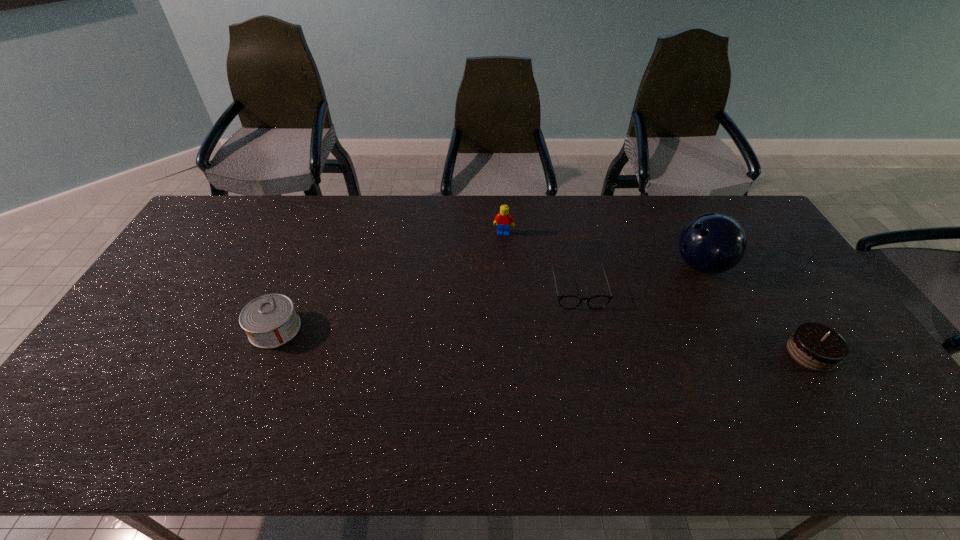
The image size is (960, 540). In order to click on unoccupied position between the fourth tallest object and the fourth object from left to right in this screenshot , I will do `click(489, 298)`.

The image size is (960, 540). In order to click on free space between the second shortest object and the third tallest object in this screenshot , I will do `click(543, 341)`.

You are a GUI agent. You are given a task and a screenshot of the screen. Output one action in this format:
    pyautogui.click(x=<x>, y=<y>)
    Task: Click on the unoccupied position between the second shortest object and the tallest object
    The image size is (960, 540).
    Given the screenshot: What is the action you would take?
    pyautogui.click(x=489, y=298)

Identify the location of vacant space in between the shortest object and the farthest object. pos(540,261).

At what (x,y) coordinates should I click in order to perform the action: click on vacant region between the can and the fourth shortest object. Please return your answer as a coordinate pair (x, y). Image resolution: width=960 pixels, height=540 pixels. Looking at the image, I should click on (389, 281).

Locate an element on the screen. unoccupied position between the third tallest object and the tallest object is located at coordinates (756, 309).

Locate an element on the screen. Image resolution: width=960 pixels, height=540 pixels. vacant region between the third tallest object and the leftmost object is located at coordinates (543, 341).

Where is `object that is the fourth closest to the leftmost object`? The image size is (960, 540). object that is the fourth closest to the leftmost object is located at coordinates (814, 346).

This screenshot has width=960, height=540. I want to click on object that stands as the fourth closest to the bowling ball, so click(x=270, y=321).

Where is `free point that satisfies the following two spatial constraints: 1. on the back side of the bowling ball; 2. on the right side of the spectacles`? Image resolution: width=960 pixels, height=540 pixels. free point that satisfies the following two spatial constraints: 1. on the back side of the bowling ball; 2. on the right side of the spectacles is located at coordinates (573, 266).